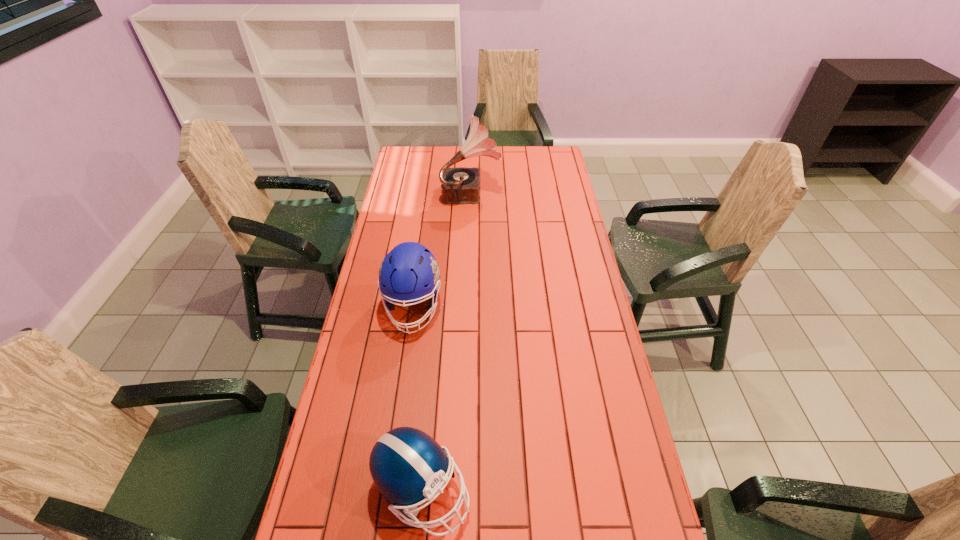
The height and width of the screenshot is (540, 960). I want to click on free space at the far left corner of the desktop, so click(408, 146).

In the image, there is a desktop. Where is `vacant space at the far right corner`? The width and height of the screenshot is (960, 540). vacant space at the far right corner is located at coordinates (551, 147).

Locate which object ranks in proximity to the record player. Please provide its 2D coordinates. Your answer should be formatted as a tuple, i.e. [(x, y)], where the tuple contains the x and y coordinates of a point satisfying the conditions above.

[(409, 272)]

At what (x,y) coordinates should I click in order to perform the action: click on object that ranks as the second closest to the farthest object. Please return your answer as a coordinate pair (x, y). Looking at the image, I should click on (409, 467).